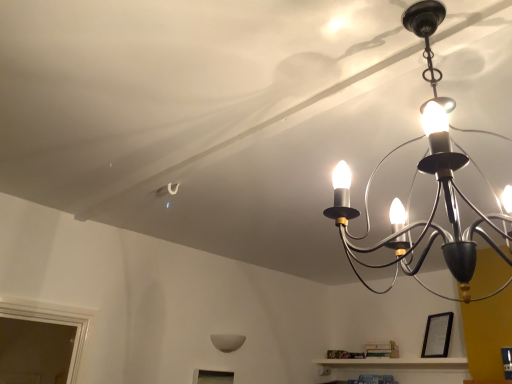
Question: From their relative heights in the image, would you say black matte picture frame at lower right is taller or shorter than matte black chandelier at upper right, which is the second lamp from back to front?

Choices:
 (A) short
 (B) tall

Answer: (A)

Question: Looking at their shapes, would you say black matte picture frame at lower right is wider or thinner than matte black chandelier at upper right, marked as the 1th lamp in a top-to-bottom arrangement?

Choices:
 (A) wide
 (B) thin

Answer: (B)

Question: Estimate the real-world distances between objects in this image. Which object is closer to the black matte picture frame at lower right?

Choices:
 (A) white matte wall sconce at lower center, which is counted as the 1th lamp, starting from the back
 (B) matte black chandelier at upper right, marked as the 1th lamp in a top-to-bottom arrangement

Answer: (A)

Question: Based on their relative distances, which object is nearer to the matte black chandelier at upper right, which ranks as the first lamp in right-to-left order?

Choices:
 (A) black matte picture frame at lower right
 (B) white matte wall sconce at lower center, marked as the second lamp in a top-to-bottom arrangement

Answer: (A)